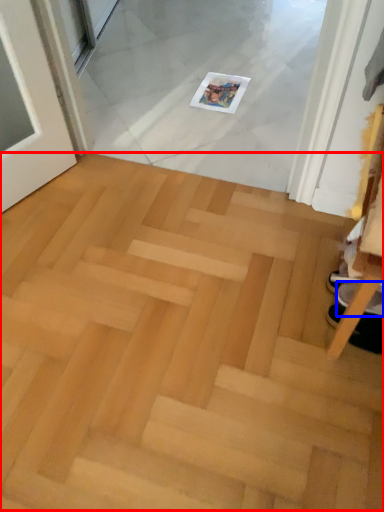
Question: Which object is closer to the camera taking this photo, stairwell (highlighted by a red box) or footwear (highlighted by a blue box)?

Choices:
 (A) stairwell
 (B) footwear

Answer: (A)